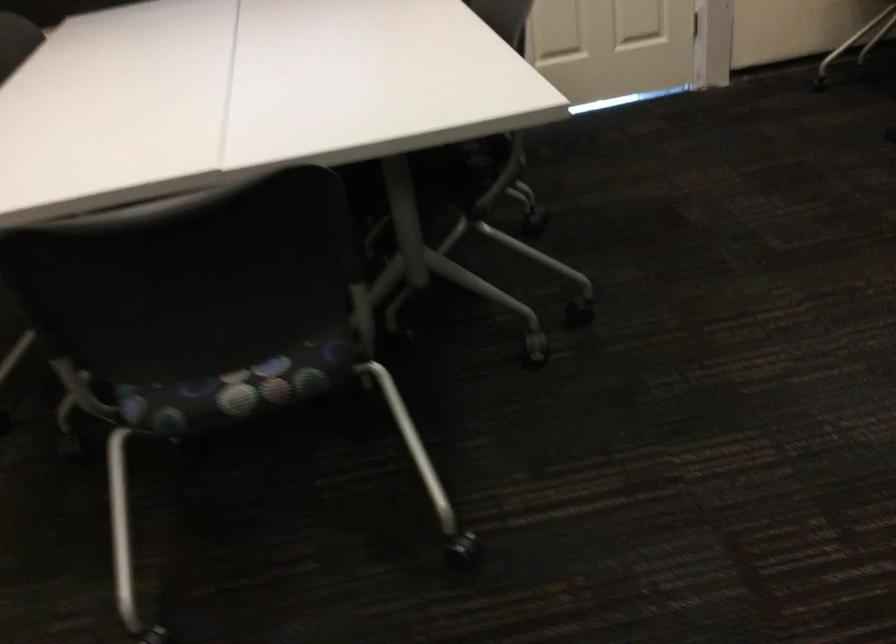
This screenshot has width=896, height=644. Describe the element at coordinates (234, 389) in the screenshot. I see `the chair sitting surface` at that location.